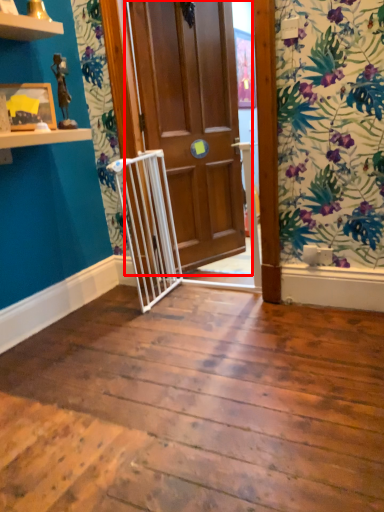
Question: From the image's perspective, where is door (annotated by the red box) located in relation to picture frame in the image?

Choices:
 (A) below
 (B) above

Answer: (B)